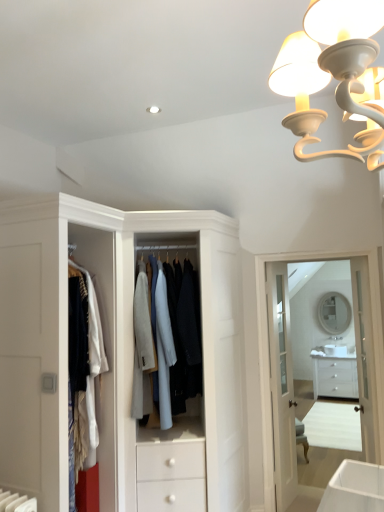
Question: Is white glossy door at center, acting as the first door starting from the left, taller than light blue fabric coat at center?

Choices:
 (A) yes
 (B) no

Answer: (A)

Question: Are white glossy door at center, acting as the first door starting from the left, and light blue fabric coat at center making contact?

Choices:
 (A) no
 (B) yes

Answer: (A)

Question: Is white glossy door at center, the 2th door when ordered from right to left, thinner than light blue fabric coat at center?

Choices:
 (A) no
 (B) yes

Answer: (B)

Question: Does white glossy door at center, acting as the first door starting from the left, lie behind light blue fabric coat at center?

Choices:
 (A) no
 (B) yes

Answer: (B)

Question: Can you confirm if white glossy door at center, acting as the first door starting from the left, is shorter than light blue fabric coat at center?

Choices:
 (A) no
 (B) yes

Answer: (A)

Question: Is light blue fabric coat at center spatially inside white glossy door at center, the 2th door when ordered from right to left, or outside of it?

Choices:
 (A) outside
 (B) inside

Answer: (A)

Question: In terms of height, does light blue fabric coat at center look taller or shorter compared to white glossy door at center, acting as the first door starting from the left?

Choices:
 (A) short
 (B) tall

Answer: (A)

Question: Would you say light blue fabric coat at center is to the left or to the right of white glossy door at center, acting as the first door starting from the left, in the picture?

Choices:
 (A) left
 (B) right

Answer: (A)

Question: Is light blue fabric coat at center in front of or behind white glossy door at center, acting as the first door starting from the left, in the image?

Choices:
 (A) behind
 (B) front

Answer: (B)

Question: Is white glossy chest of drawers at lower right in front of or behind matte white mirror at center in the image?

Choices:
 (A) front
 (B) behind

Answer: (A)

Question: From the image's perspective, is white glossy chest of drawers at lower right located above or below matte white mirror at center?

Choices:
 (A) above
 (B) below

Answer: (B)

Question: Looking at the image, does white glossy chest of drawers at lower right seem bigger or smaller compared to matte white mirror at center?

Choices:
 (A) big
 (B) small

Answer: (A)

Question: From their relative heights in the image, would you say white glossy chest of drawers at lower right is taller or shorter than matte white mirror at center?

Choices:
 (A) tall
 (B) short

Answer: (B)

Question: Would you say white glossy medicine cabinet at upper center is to the left or to the right of light blue fabric coat at center in the picture?

Choices:
 (A) left
 (B) right

Answer: (B)

Question: In the image, is white glossy medicine cabinet at upper center positioned in front of or behind light blue fabric coat at center?

Choices:
 (A) front
 (B) behind

Answer: (B)